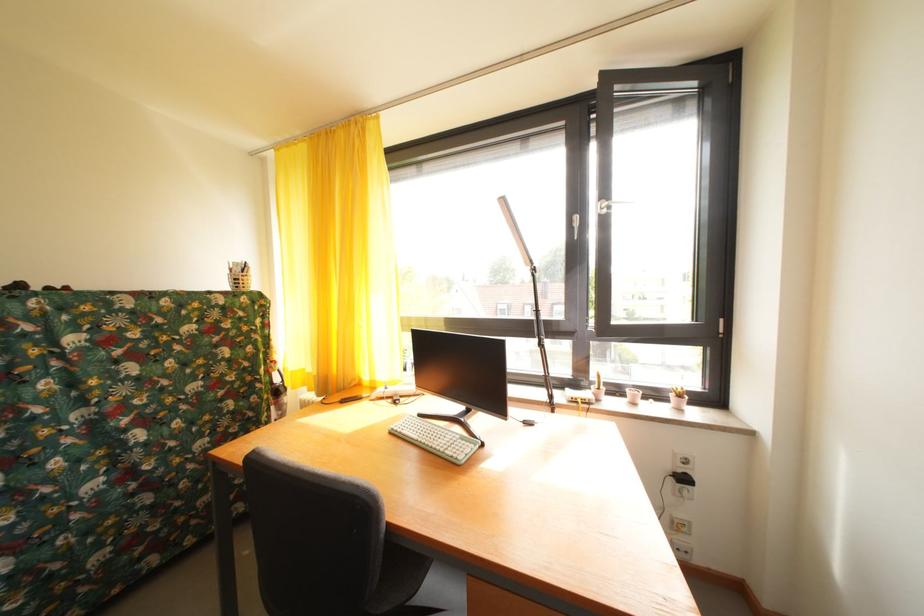
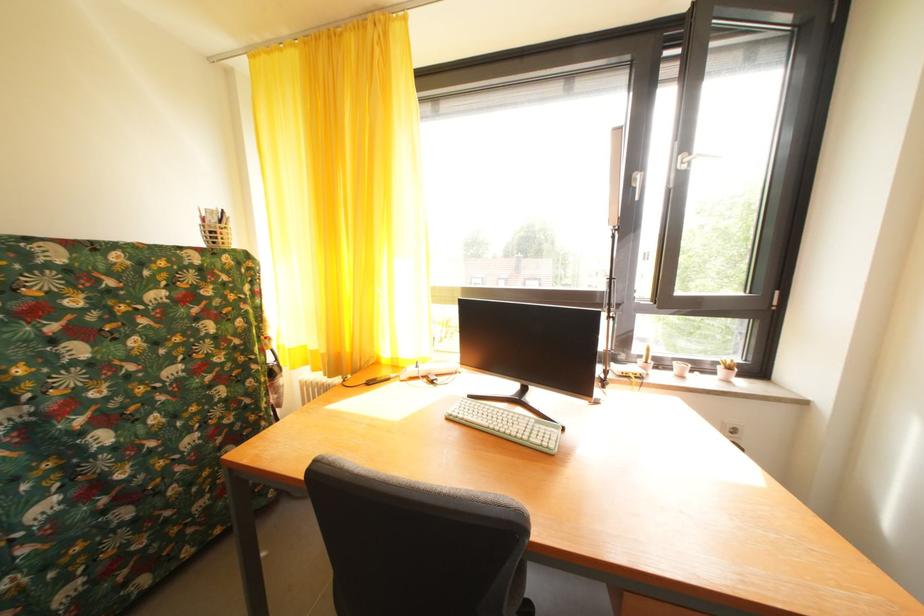
In a continuous first-person perspective shot, in which direction is the camera moving?

The movement direction of the cameraman is left, forward.